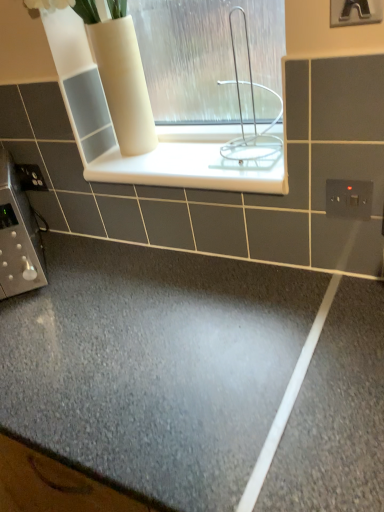
Question: Is white plastic electric outlet at upper right, which ranks as the 2th electric outlet in left-to-right order, at the left side of white glossy ledge at center?

Choices:
 (A) no
 (B) yes

Answer: (A)

Question: Is white glossy ledge at center at the back of white plastic electric outlet at upper right, acting as the 2th electric outlet starting from the top?

Choices:
 (A) no
 (B) yes

Answer: (A)

Question: From a real-world perspective, is white plastic electric outlet at upper right, the 1th electric outlet from the front, on top of white glossy ledge at center?

Choices:
 (A) yes
 (B) no

Answer: (B)

Question: Is white plastic electric outlet at upper right, acting as the 2th electric outlet starting from the top, shorter than white glossy ledge at center?

Choices:
 (A) yes
 (B) no

Answer: (B)

Question: Is white plastic electric outlet at upper right, acting as the 2th electric outlet starting from the top, positioned in front of white glossy ledge at center?

Choices:
 (A) no
 (B) yes

Answer: (B)

Question: Do you think satin silver switch at lower left, the 2th electric outlet in the front-to-back sequence, is within white plastic electric outlet at upper right, acting as the 2th electric outlet starting from the top, or outside of it?

Choices:
 (A) inside
 (B) outside

Answer: (B)

Question: Is satin silver switch at lower left, the second electric outlet positioned from the right, in front of or behind white plastic electric outlet at upper right, which ranks as the 2th electric outlet in back-to-front order, in the image?

Choices:
 (A) front
 (B) behind

Answer: (B)

Question: Considering the positions of satin silver switch at lower left, the second electric outlet positioned from the right, and white plastic electric outlet at upper right, which ranks as the 2th electric outlet in back-to-front order, in the image, is satin silver switch at lower left, the second electric outlet positioned from the right, bigger or smaller than white plastic electric outlet at upper right, which ranks as the 2th electric outlet in back-to-front order,?

Choices:
 (A) big
 (B) small

Answer: (A)

Question: Considering the positions of satin silver switch at lower left, the second electric outlet positioned from the right, and white plastic electric outlet at upper right, which ranks as the 2th electric outlet in left-to-right order, in the image, is satin silver switch at lower left, the second electric outlet positioned from the right, taller or shorter than white plastic electric outlet at upper right, which ranks as the 2th electric outlet in left-to-right order,?

Choices:
 (A) tall
 (B) short

Answer: (A)

Question: From the image's perspective, is white glossy ledge at center positioned above or below white wire rack at center?

Choices:
 (A) above
 (B) below

Answer: (B)

Question: From a real-world perspective, relative to white wire rack at center, is white glossy ledge at center vertically above or below?

Choices:
 (A) below
 (B) above

Answer: (A)

Question: Is white glossy ledge at center in front of or behind white wire rack at center in the image?

Choices:
 (A) front
 (B) behind

Answer: (B)

Question: Visually, is white glossy ledge at center positioned to the left or to the right of white wire rack at center?

Choices:
 (A) left
 (B) right

Answer: (A)

Question: In the image, is white glossy ledge at center positioned in front of or behind satin silver switch at lower left, which ranks as the 2th electric outlet in bottom-to-top order?

Choices:
 (A) behind
 (B) front

Answer: (B)

Question: Considering the positions of white glossy ledge at center and satin silver switch at lower left, the first electric outlet in the back-to-front sequence, in the image, is white glossy ledge at center bigger or smaller than satin silver switch at lower left, the first electric outlet in the back-to-front sequence,?

Choices:
 (A) big
 (B) small

Answer: (A)